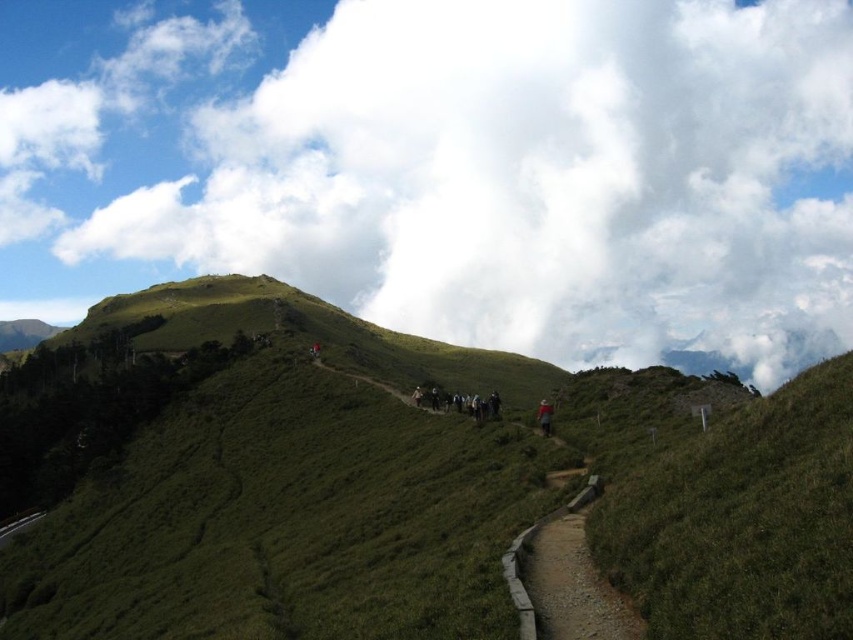
You are standing at the starting point of the mountain trail and see two points marked on the map. The first point is at coordinate point (599, 490) and the second is at point (541, 406). If you want to reach the point that is closer to the camera, which coordinate should you head towards?

Point (599, 490) is in front of point (541, 406), so the point closer to the camera is point (599, 490).

You are standing at the starting point of the mountain trail and looking towards the horizon. There is a point marked at coordinates (448, 164). What object is located at that point?

The point at coordinates (448, 164) corresponds to a white fluffy cloud at upper center.

You are a hiker standing at the trailhead looking at the mountain trail. You notice a white fluffy cloud at upper center and dark gray fabric backpacks at center. How far apart are these two objects from each other?

The white fluffy cloud at upper center is 2656.00 feet away from the dark gray fabric backpacks at center.